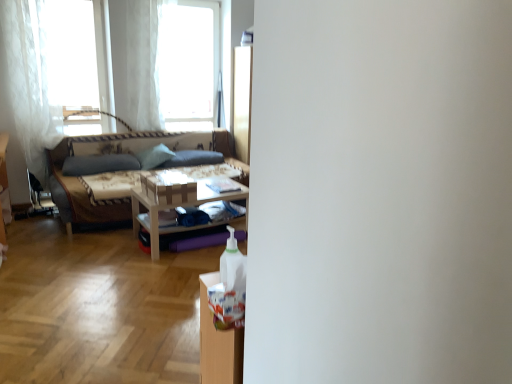
Question: Can you confirm if green fabric pillow at center, which ranks as the 2th pillow in left-to-right order, is positioned to the left of white sheer curtain at upper left, positioned as the 2th window in right-to-left order?

Choices:
 (A) yes
 (B) no

Answer: (B)

Question: Is green fabric pillow at center, which ranks as the 2th pillow in left-to-right order, outside white sheer curtain at upper left, positioned as the 2th window in right-to-left order?

Choices:
 (A) yes
 (B) no

Answer: (A)

Question: Is green fabric pillow at center, which ranks as the 2th pillow in left-to-right order, turned away from white sheer curtain at upper left, the first window when ordered from left to right?

Choices:
 (A) no
 (B) yes

Answer: (A)

Question: Is green fabric pillow at center, the 2th pillow from the right, to the right of white sheer curtain at upper left, the first window when ordered from left to right, from the viewer's perspective?

Choices:
 (A) no
 (B) yes

Answer: (B)

Question: Does green fabric pillow at center, the 2th pillow from the right, have a greater width compared to white sheer curtain at upper left, the first window when ordered from left to right?

Choices:
 (A) yes
 (B) no

Answer: (A)

Question: Is white sheer curtain at upper left, positioned as the 2th window in right-to-left order, spatially inside wooden table at center, or outside of it?

Choices:
 (A) outside
 (B) inside

Answer: (A)

Question: Is white sheer curtain at upper left, the first window when ordered from left to right, to the left or to the right of wooden table at center in the image?

Choices:
 (A) left
 (B) right

Answer: (A)

Question: Based on their sizes in the image, would you say white sheer curtain at upper left, the first window when ordered from left to right, is bigger or smaller than wooden table at center?

Choices:
 (A) big
 (B) small

Answer: (A)

Question: From their relative heights in the image, would you say white sheer curtain at upper left, the first window when ordered from left to right, is taller or shorter than wooden table at center?

Choices:
 (A) short
 (B) tall

Answer: (B)

Question: From the image's perspective, is white sheer curtain at upper left, the 1th curtain positioned from the right, positioned above or below dark gray fabric pillow at center, which is the 1th pillow from right to left?

Choices:
 (A) above
 (B) below

Answer: (A)

Question: In terms of height, does white sheer curtain at upper left, which appears as the second curtain when viewed from the left, look taller or shorter compared to dark gray fabric pillow at center, arranged as the third pillow when viewed from the left?

Choices:
 (A) short
 (B) tall

Answer: (B)

Question: Considering the positions of point (140, 112) and point (219, 152), is point (140, 112) closer or farther from the camera than point (219, 152)?

Choices:
 (A) closer
 (B) farther

Answer: (A)

Question: In terms of width, does white sheer curtain at upper left, which appears as the second curtain when viewed from the left, look wider or thinner when compared to dark gray fabric pillow at center, arranged as the third pillow when viewed from the left?

Choices:
 (A) wide
 (B) thin

Answer: (B)

Question: From the image's perspective, is textured beige fabric couch at left positioned above or below wooden table at center?

Choices:
 (A) above
 (B) below

Answer: (A)

Question: Relative to wooden table at center, is textured beige fabric couch at left in front or behind?

Choices:
 (A) front
 (B) behind

Answer: (B)